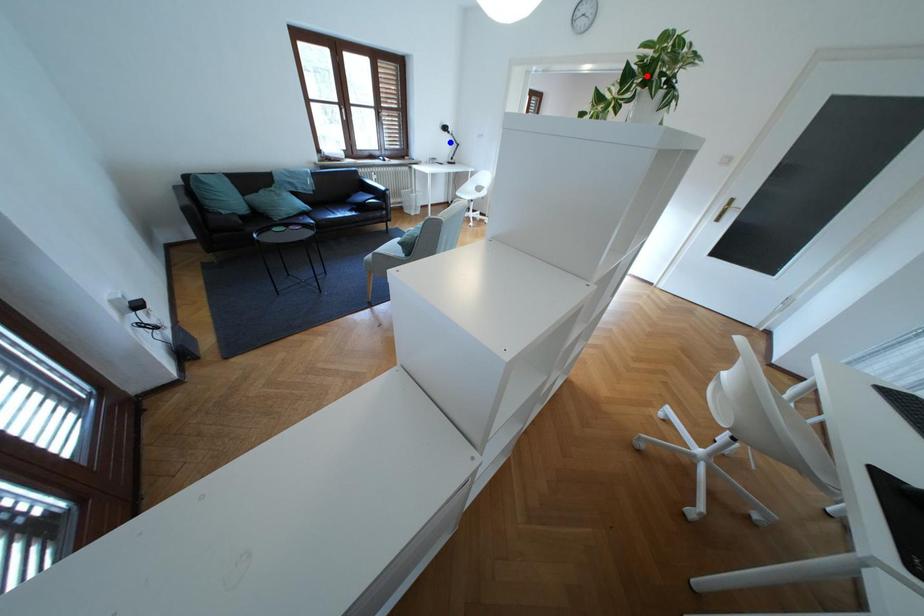
Question: Two points are marked on the image. Which point is closer to the camera?

Choices:
 (A) Blue point is closer.
 (B) Red point is closer.

Answer: (B)